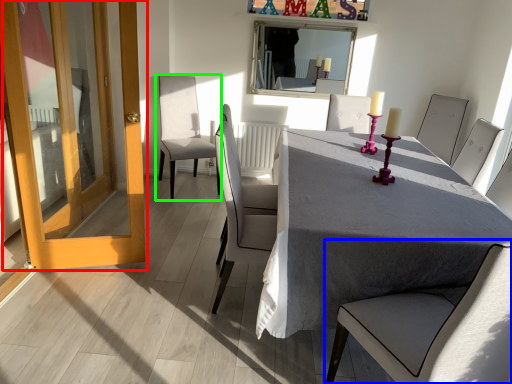
Question: Which is nearer to the door (highlighted by a red box)? chair (highlighted by a blue box) or chair (highlighted by a green box).

Choices:
 (A) chair
 (B) chair

Answer: (B)